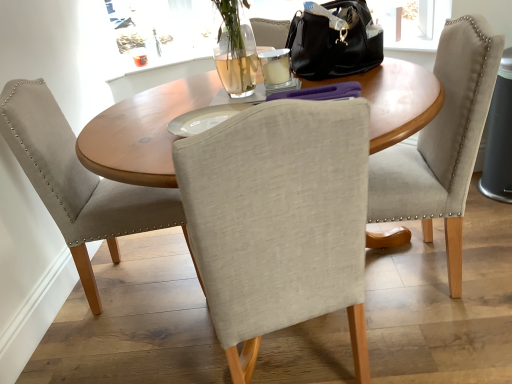
Question: Does point (352, 39) appear closer or farther from the camera than point (394, 213)?

Choices:
 (A) farther
 (B) closer

Answer: (A)

Question: In the image, is black leather handbag at upper center positioned in front of or behind light gray fabric chair at center, acting as the 2th chair starting from the left?

Choices:
 (A) behind
 (B) front

Answer: (A)

Question: Based on their relative distances, which object is nearer to the light gray fabric chair at center, acting as the 2th chair starting from the left?

Choices:
 (A) wooden table at center
 (B) black leather handbag at upper center
 (C) light gray fabric chair at left, placed as the 1th chair when sorted from left to right

Answer: (B)

Question: Estimate the real-world distances between objects in this image. Which object is closer to the light gray fabric chair at left, placed as the 1th chair when sorted from left to right?

Choices:
 (A) black leather handbag at upper center
 (B) light gray fabric chair at center, acting as the 2th chair starting from the left
 (C) wooden table at center

Answer: (C)